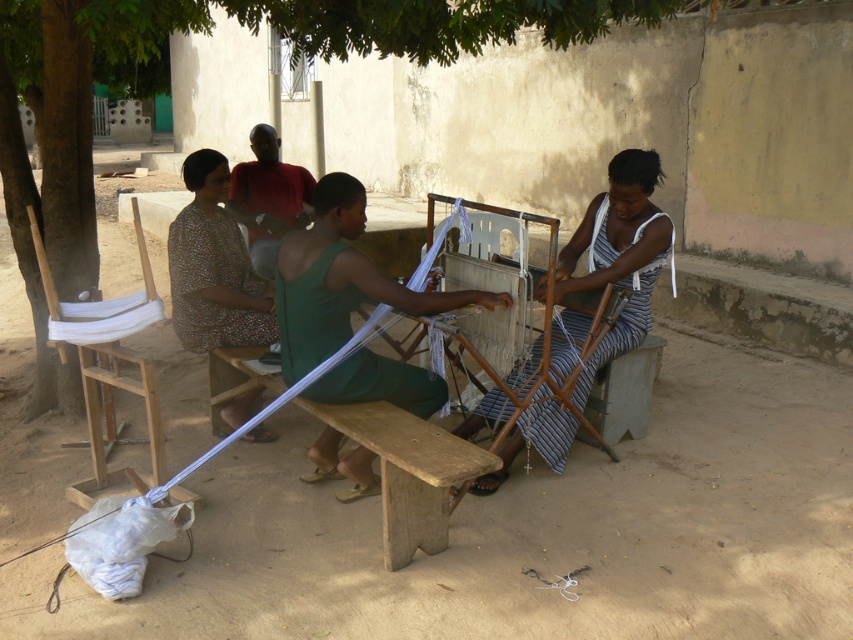
Can you confirm if green fabric at center is taller than printed fabric dress at center?

Yes.

Is point (352, 216) farther from viewer compared to point (194, 244)?

That is False.

This screenshot has width=853, height=640. What do you see at coordinates (341, 280) in the screenshot?
I see `green fabric at center` at bounding box center [341, 280].

Find the location of `green fabric at center`. green fabric at center is located at coordinates (341, 280).

Is green fabric at center to the left of striped fabric at center from the viewer's perspective?

Correct, you'll find green fabric at center to the left of striped fabric at center.

Is green fabric at center further to camera compared to striped fabric at center?

No, green fabric at center is in front of striped fabric at center.

Between point (293, 260) and point (590, 376), which one is positioned behind?

The point (590, 376) is more distant.

Find the location of a particular element. green fabric at center is located at coordinates (341, 280).

You are a GUI agent. You are given a task and a screenshot of the screen. Output one action in this format:
    pyautogui.click(x=<x>, y=<y>)
    Task: Click on the green leafy tree at upper left
    This screenshot has height=640, width=853.
    Given the screenshot: What is the action you would take?
    pyautogui.click(x=167, y=83)

Image resolution: width=853 pixels, height=640 pixels. Find the location of `green leafy tree at upper left`. green leafy tree at upper left is located at coordinates (167, 83).

Find the location of `green leafy tree at upper left`. green leafy tree at upper left is located at coordinates (167, 83).